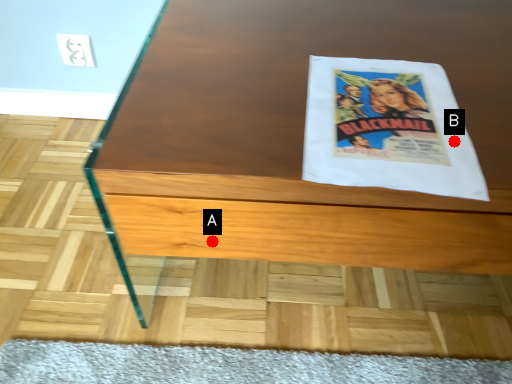
Question: Two points are circled on the image, labeled by A and B beside each circle. Which point is closer to the camera taking this photo?

Choices:
 (A) A is closer
 (B) B is closer

Answer: (B)